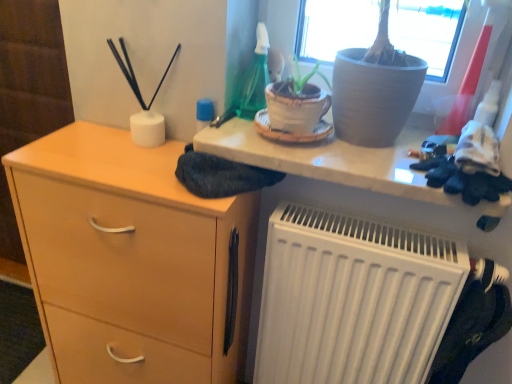
This screenshot has width=512, height=384. Describe the element at coordinates (337, 163) in the screenshot. I see `matte gray pot at upper center` at that location.

This screenshot has width=512, height=384. In order to click on matte gray pot at upper center in this screenshot , I will do `click(337, 163)`.

From the image's perspective, is matte gray pot at upper center located beneath light wood/finish chest of drawers at left?

No.

Considering the sizes of matte gray pot at upper center and light wood/finish chest of drawers at left in the image, is matte gray pot at upper center bigger or smaller than light wood/finish chest of drawers at left?

Clearly, matte gray pot at upper center is smaller in size than light wood/finish chest of drawers at left.

Which object is positioned more to the left, matte gray pot at upper center or light wood/finish chest of drawers at left?

light wood/finish chest of drawers at left is more to the left.

Would you say matte gray pot at upper center is a long distance from light wood/finish chest of drawers at left?

They are positioned close to each other.

From a real-world perspective, which object rests below the other?

white matte radiator at lower right is physically lower.

Could you tell me if white matte radiator at lower right is facing matte gray pot at upper center?

No, white matte radiator at lower right does not turn towards matte gray pot at upper center.

Based on the photo, is white matte radiator at lower right inside or outside of matte gray pot at upper center?

white matte radiator at lower right exists outside the volume of matte gray pot at upper center.

Which is behind, point (367, 289) or point (404, 179)?

The point (367, 289) is farther from the camera.

Does point (222, 140) come in front of point (404, 301)?

Yes, point (222, 140) is in front of point (404, 301).

Based on the photo, is white matte radiator at lower right surrounded by matte gray pot at upper center?

Definitely not — white matte radiator at lower right is not inside matte gray pot at upper center.

Is matte gray pot at upper center in front of or behind white matte radiator at lower right in the image?

Clearly, matte gray pot at upper center is in front of white matte radiator at lower right.

What's the angular difference between matte gray pot at upper center and white matte radiator at lower right's facing directions?

0.268 degrees.

How distant is light wood/finish chest of drawers at left from white matte radiator at lower right?

12.10 inches.

Is light wood/finish chest of drawers at left to the left or to the right of white matte radiator at lower right in the image?

In the image, light wood/finish chest of drawers at left appears on the left side of white matte radiator at lower right.

In terms of height, does light wood/finish chest of drawers at left look taller or shorter compared to white matte radiator at lower right?

Clearly, light wood/finish chest of drawers at left is taller compared to white matte radiator at lower right.

Is light wood/finish chest of drawers at left facing away from white matte radiator at lower right?

light wood/finish chest of drawers at left does not have its back to white matte radiator at lower right.

Is light wood/finish chest of drawers at left positioned before matte gray pot at upper center?

No, light wood/finish chest of drawers at left is behind matte gray pot at upper center.

Considering the sizes of objects light wood/finish chest of drawers at left and matte gray pot at upper center in the image provided, who is bigger, light wood/finish chest of drawers at left or matte gray pot at upper center?

Bigger between the two is light wood/finish chest of drawers at left.

From the image's perspective, is light wood/finish chest of drawers at left on top of matte gray pot at upper center?

No, from the image's perspective, light wood/finish chest of drawers at left is not on top of matte gray pot at upper center.

Which object is wider, light wood/finish chest of drawers at left or matte gray pot at upper center?

With larger width is matte gray pot at upper center.

From a real-world perspective, is white matte radiator at lower right on top of light wood/finish chest of drawers at left?

Correct, in the physical world, white matte radiator at lower right is higher than light wood/finish chest of drawers at left.

Is white matte radiator at lower right bigger or smaller than light wood/finish chest of drawers at left?

Clearly, white matte radiator at lower right is smaller in size than light wood/finish chest of drawers at left.

How distant is white matte radiator at lower right from light wood/finish chest of drawers at left?

The distance of white matte radiator at lower right from light wood/finish chest of drawers at left is 12.10 inches.

Is white matte radiator at lower right far from light wood/finish chest of drawers at left?

No, white matte radiator at lower right is not far away from light wood/finish chest of drawers at left.

Locate an element on the screen. This screenshot has width=512, height=384. writing desk that appears above the light wood/finish chest of drawers at left (from a real-world perspective) is located at coordinates (337, 163).

This screenshot has height=384, width=512. I want to click on writing desk to the left of white matte radiator at lower right, so pos(337,163).

From the image, which object appears to be farther from matte gray pot at upper center, white matte radiator at lower right or light wood/finish chest of drawers at left?

Based on the image, light wood/finish chest of drawers at left appears to be further to matte gray pot at upper center.

Estimate the real-world distances between objects in this image. Which object is further from light wood/finish chest of drawers at left, white matte radiator at lower right or matte gray pot at upper center?

matte gray pot at upper center lies further to light wood/finish chest of drawers at left than the other object.

From the image, which object appears to be farther from matte gray pot at upper center, light wood/finish chest of drawers at left or white matte radiator at lower right?

light wood/finish chest of drawers at left lies further to matte gray pot at upper center than the other object.

When comparing their distances from light wood/finish chest of drawers at left, does matte gray pot at upper center or white matte radiator at lower right seem further?

matte gray pot at upper center lies further to light wood/finish chest of drawers at left than the other object.

Which object lies nearer to the anchor point white matte radiator at lower right, light wood/finish chest of drawers at left or matte gray pot at upper center?

matte gray pot at upper center is closer to white matte radiator at lower right.

Looking at the image, which one is located closer to white matte radiator at lower right, matte gray pot at upper center or light wood/finish chest of drawers at left?

matte gray pot at upper center.

Where is `writing desk located between light wood/finish chest of drawers at left and white matte radiator at lower right in the left-right direction`? The image size is (512, 384). writing desk located between light wood/finish chest of drawers at left and white matte radiator at lower right in the left-right direction is located at coordinates (337, 163).